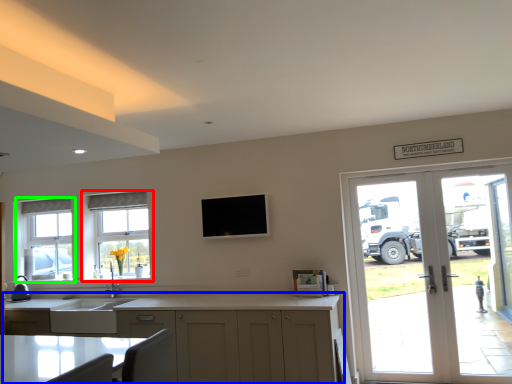
Question: Estimate the real-world distances between objects in this image. Which object is farther from window (highlighted by a red box), cabinetry (highlighted by a blue box) or window (highlighted by a green box)?

Choices:
 (A) cabinetry
 (B) window

Answer: (A)